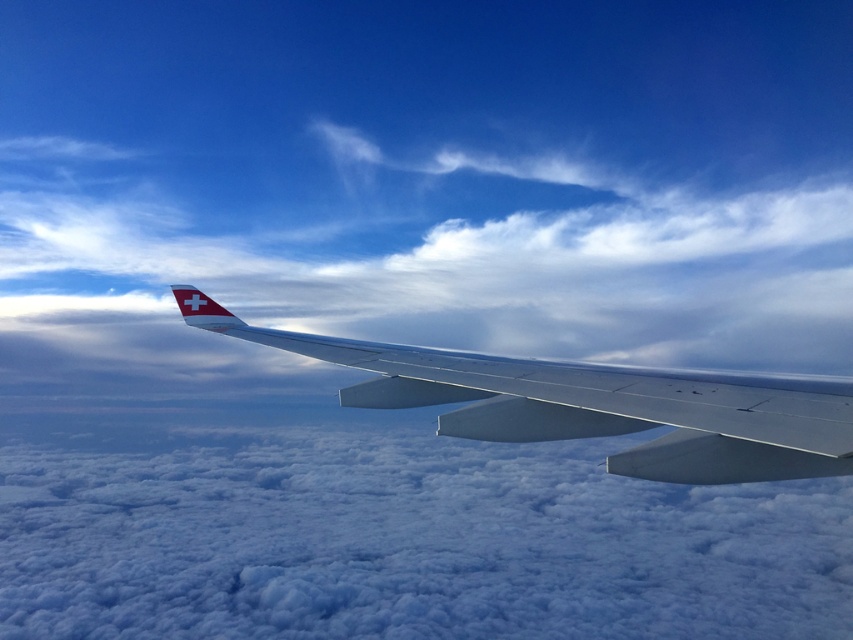
Which of these two, white fluffy cloud at center or metallic gray wing at center, stands taller?

Standing taller between the two is white fluffy cloud at center.

Does point (602, 173) come farther from viewer compared to point (451, 378)?

Yes, point (602, 173) is farther from viewer.

Which is in front, point (129, 371) or point (619, 374)?

Positioned in front is point (619, 374).

Locate an element on the screen. The height and width of the screenshot is (640, 853). white fluffy cloud at center is located at coordinates (404, 262).